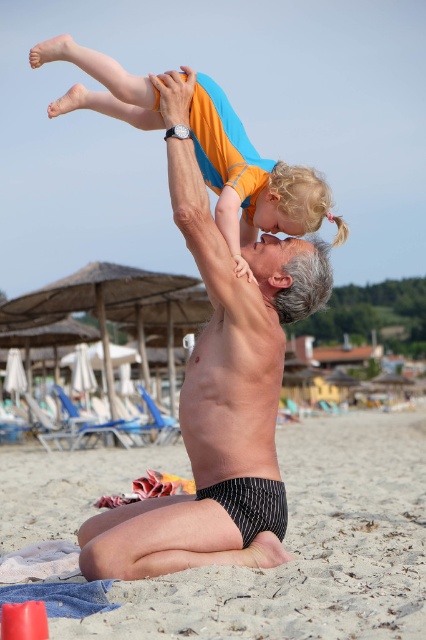
Question: Considering the real-world distances, which object is farthest from the smooth beige sand at lower center?

Choices:
 (A) orange cotton shirt at upper center
 (B) smooth skin man at center

Answer: (A)

Question: Does smooth beige sand at lower center appear under orange cotton shirt at upper center?

Choices:
 (A) yes
 (B) no

Answer: (A)

Question: Does smooth beige sand at lower center have a smaller size compared to orange cotton shirt at upper center?

Choices:
 (A) yes
 (B) no

Answer: (B)

Question: Is smooth skin man at center to the right of orange cotton shirt at upper center from the viewer's perspective?

Choices:
 (A) yes
 (B) no

Answer: (B)

Question: Which of the following is the farthest from the observer?

Choices:
 (A) orange cotton shirt at upper center
 (B) smooth skin man at center

Answer: (A)

Question: Which object is the closest to the smooth beige sand at lower center?

Choices:
 (A) orange cotton shirt at upper center
 (B) smooth skin man at center

Answer: (B)